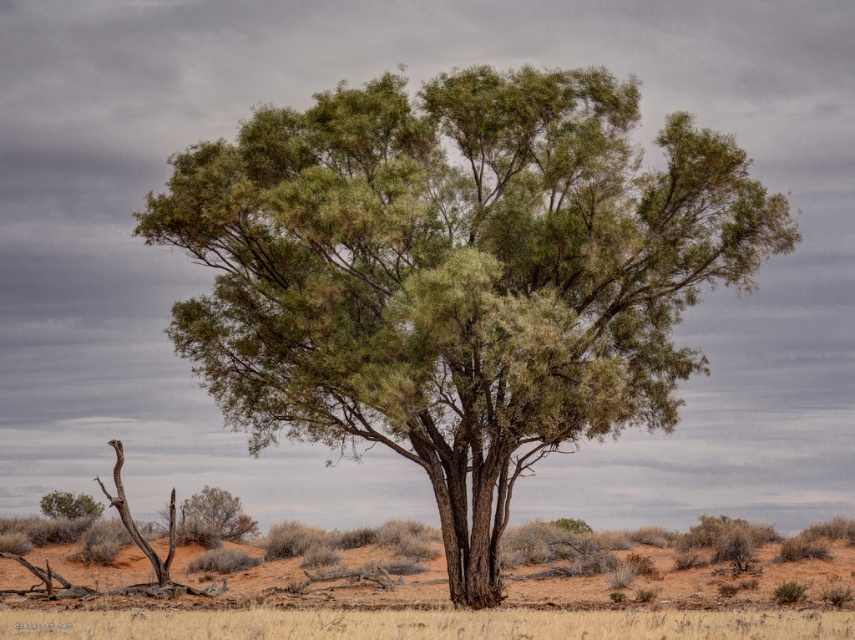
Question: Which object is positioned farthest from the green leafy bush at lower left?

Choices:
 (A) green leafy shrub at lower left
 (B) green textured tree at center
 (C) dry grass at center

Answer: (C)

Question: Which of the following is the farthest from the observer?

Choices:
 (A) (199, 531)
 (B) (59, 513)
 (C) (438, 88)

Answer: (B)

Question: From the image, what is the correct spatial relationship of green textured tree at center in relation to dry grass at center?

Choices:
 (A) right
 (B) left

Answer: (A)

Question: Which point is closer to the camera?

Choices:
 (A) (516, 627)
 (B) (54, 502)

Answer: (A)

Question: Is green textured tree at center behind green leafy bush at lower left?

Choices:
 (A) no
 (B) yes

Answer: (A)

Question: Does green textured tree at center appear over dry grass at center?

Choices:
 (A) yes
 (B) no

Answer: (A)